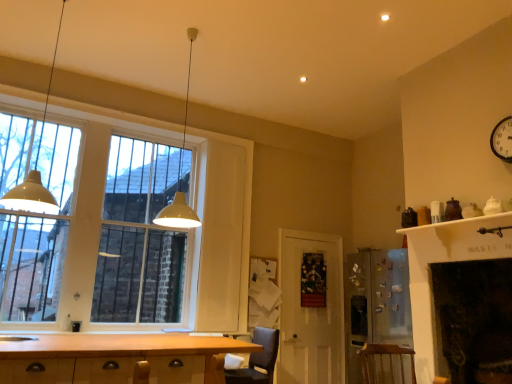
Question: From a real-world perspective, is matte glass window at left located higher than wooden cabinet at lower left?

Choices:
 (A) no
 (B) yes

Answer: (B)

Question: Considering the relative positions of matte glass window at left and wooden cabinet at lower left in the image provided, is matte glass window at left behind wooden cabinet at lower left?

Choices:
 (A) no
 (B) yes

Answer: (B)

Question: Is matte glass window at left shorter than wooden cabinet at lower left?

Choices:
 (A) yes
 (B) no

Answer: (B)

Question: Is matte glass window at left touching wooden cabinet at lower left?

Choices:
 (A) yes
 (B) no

Answer: (B)

Question: Is wooden cabinet at lower left located within matte glass window at left?

Choices:
 (A) no
 (B) yes

Answer: (A)

Question: Does matte glass window at left turn towards wooden cabinet at lower left?

Choices:
 (A) no
 (B) yes

Answer: (B)

Question: From a real-world perspective, is dark gray fabric armchair at lower center, the second armchair when ordered from right to left, positioned under wooden at lower right, the second armchair viewed from the left, based on gravity?

Choices:
 (A) yes
 (B) no

Answer: (B)

Question: Would you say wooden at lower right, the second armchair viewed from the left, is part of dark gray fabric armchair at lower center, the second armchair when ordered from right to left,'s contents?

Choices:
 (A) yes
 (B) no

Answer: (B)

Question: Does dark gray fabric armchair at lower center, the second armchair when ordered from right to left, lie behind wooden at lower right, arranged as the first armchair when viewed from the right?

Choices:
 (A) yes
 (B) no

Answer: (B)

Question: Is dark gray fabric armchair at lower center, the second armchair when ordered from right to left, far away from wooden at lower right, arranged as the first armchair when viewed from the right?

Choices:
 (A) yes
 (B) no

Answer: (A)

Question: Is dark gray fabric armchair at lower center, the second armchair when ordered from right to left, oriented towards wooden at lower right, the second armchair viewed from the left?

Choices:
 (A) yes
 (B) no

Answer: (B)

Question: Can you confirm if dark gray fabric armchair at lower center, placed as the 1th armchair when sorted from left to right, is smaller than wooden at lower right, arranged as the first armchair when viewed from the right?

Choices:
 (A) no
 (B) yes

Answer: (B)

Question: Does matte glass window at left have a greater height compared to white glossy sink at lower left?

Choices:
 (A) yes
 (B) no

Answer: (A)